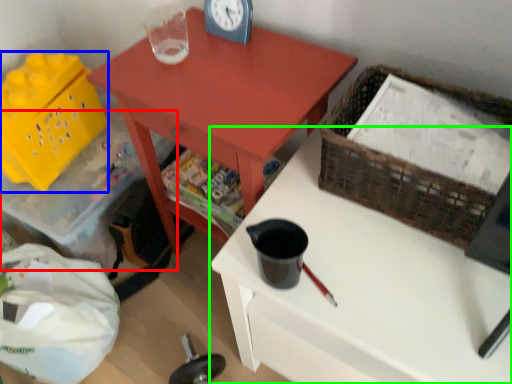
Question: Which object is positioned farthest from storage box (highlighted by a red box)? Select from basket (highlighted by a blue box) and desk (highlighted by a green box).

Choices:
 (A) basket
 (B) desk

Answer: (B)